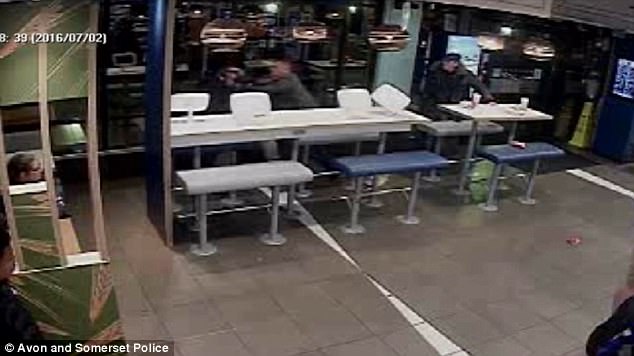
Where is `wallpaper`? This screenshot has height=356, width=634. wallpaper is located at coordinates (28, 85), (60, 296), (35, 238).